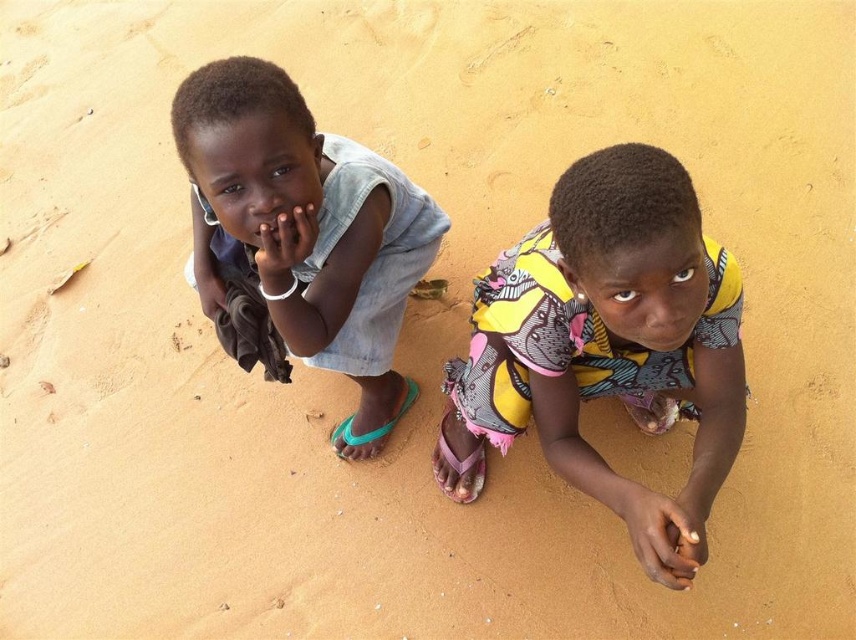
You are a drone operator trying to capture aerial footage of two children on a sandy beach. The first child is at point (x=627, y=378) and the second child is at point (x=227, y=209). From your current position, which child is closer to you?

A: Point (x=227, y=209) is closer to you than point (x=627, y=378) because the latter is positioned behind the former.

You are organizing a clothing display and need to arrange the printed fabric dress at center and the light blue denim shorts at left. Given their sizes, which item should you place first in a limited space to ensure both fit?

The printed fabric dress at center occupies less space than the light blue denim shorts at left, so you should place the printed fabric dress at center first to accommodate both items in the limited space.